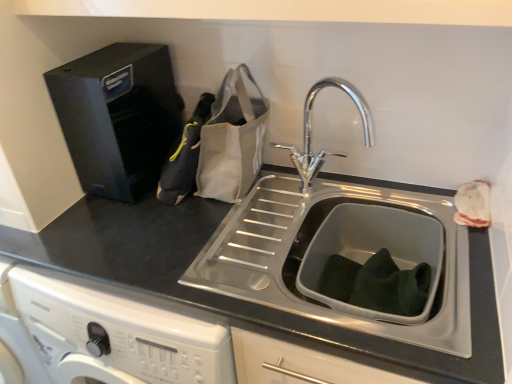
The width and height of the screenshot is (512, 384). I want to click on free space above black plastic water dispenser at upper left (from a real-world perspective), so click(114, 57).